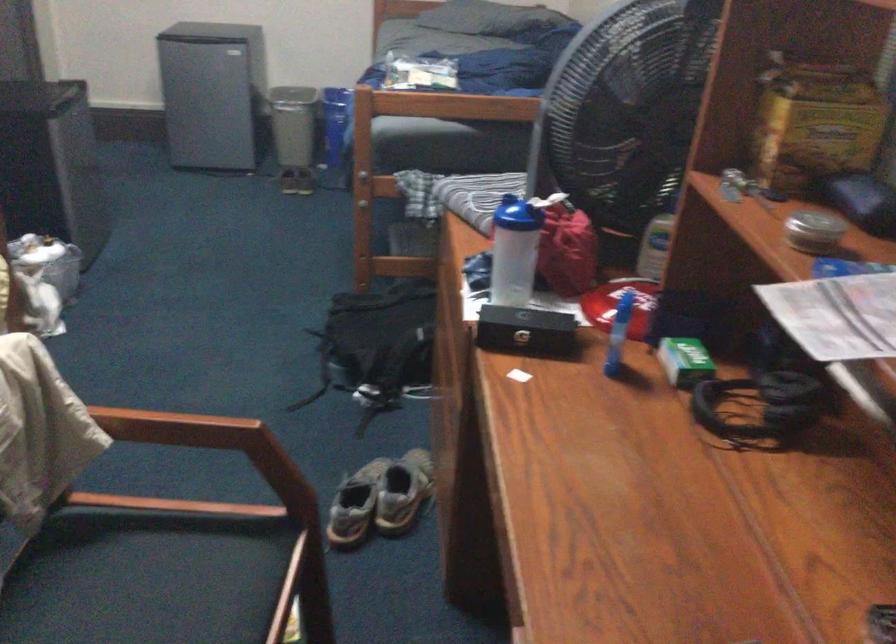
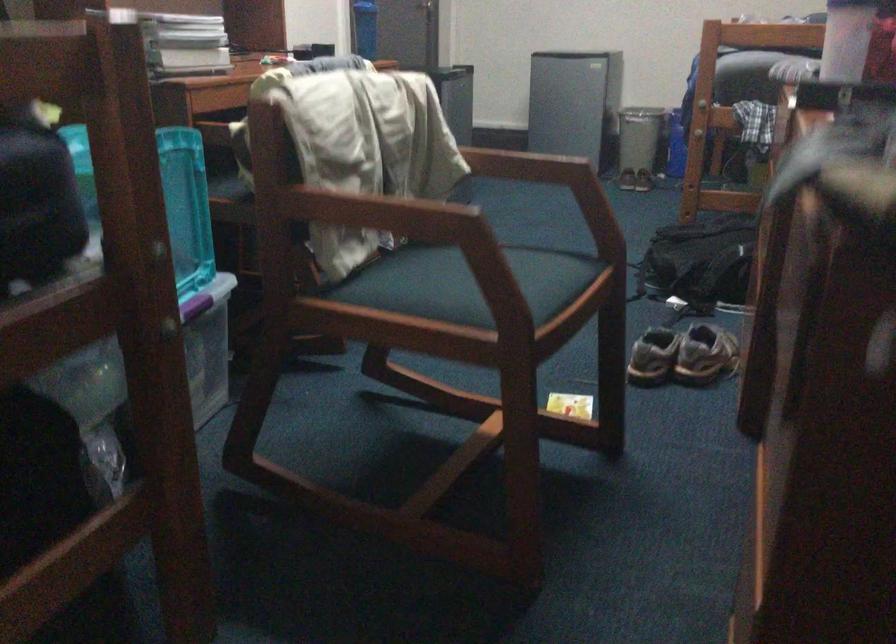
Where in the second image is the point corresponding to (x=380, y=509) from the first image?

(682, 355)